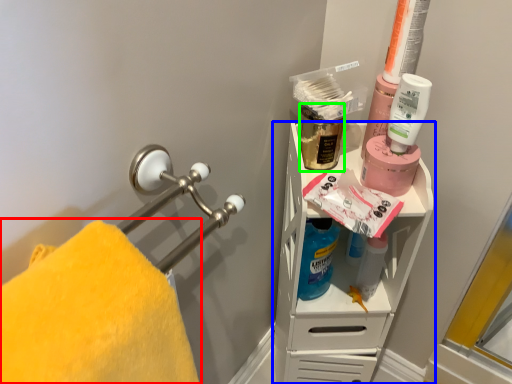
Question: Which is nearer to the towel (highlighted by a red box)? shelf (highlighted by a blue box) or mouthwash (highlighted by a green box).

Choices:
 (A) shelf
 (B) mouthwash

Answer: (A)